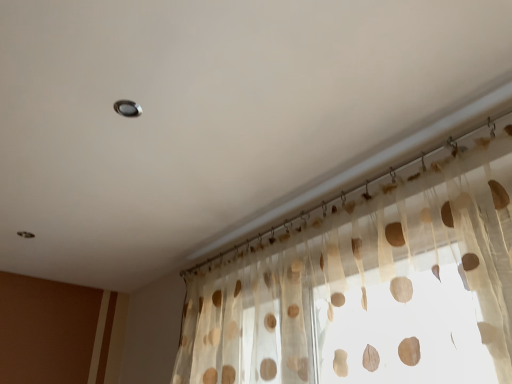
Question: Is metallic circular light at upper center inside the boundaries of translucent fabric curtain at upper center, or outside?

Choices:
 (A) inside
 (B) outside

Answer: (B)

Question: From a real-world perspective, is metallic circular light at upper center above or below translucent fabric curtain at upper center?

Choices:
 (A) below
 (B) above

Answer: (B)

Question: Is point (121, 102) closer or farther from the camera than point (394, 256)?

Choices:
 (A) closer
 (B) farther

Answer: (A)

Question: Is translucent fabric curtain at upper center in front of or behind metallic circular light at upper center in the image?

Choices:
 (A) behind
 (B) front

Answer: (B)

Question: From the image's perspective, is translucent fabric curtain at upper center located above or below metallic circular light at upper center?

Choices:
 (A) below
 (B) above

Answer: (A)

Question: Would you say translucent fabric curtain at upper center is to the left or to the right of metallic circular light at upper center in the picture?

Choices:
 (A) right
 (B) left

Answer: (A)

Question: Which is correct: translucent fabric curtain at upper center is inside metallic circular light at upper center, or outside of it?

Choices:
 (A) inside
 (B) outside

Answer: (B)